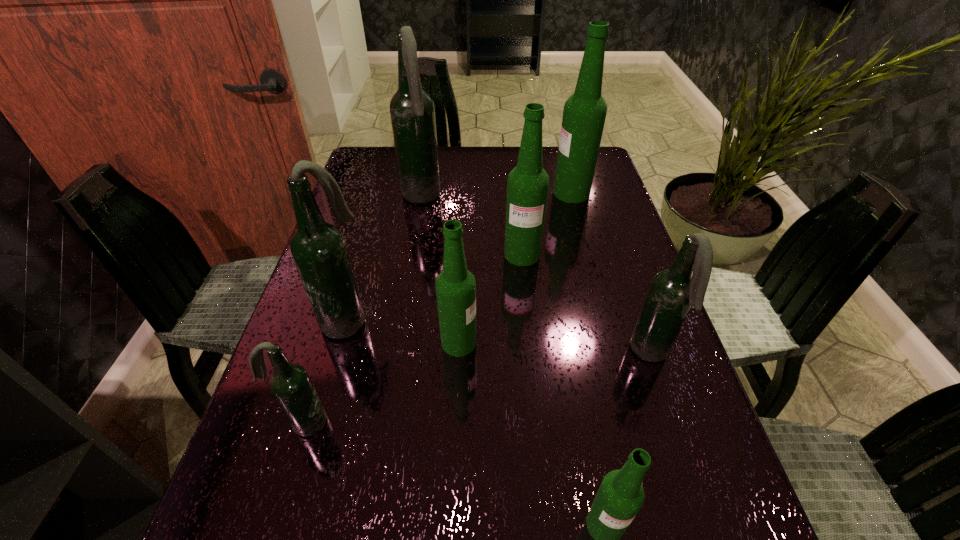
Locate an element on the screen. the second nearest object is located at coordinates (290, 383).

Identify the location of the smallest dark beer bottle. [290, 383].

You are a GUI agent. You are given a task and a screenshot of the screen. Output one action in this format:
    pyautogui.click(x=<x>, y=<y>)
    Task: Click on the vacant region located on the label of the farthest green beer bottle
    
    Given the screenshot: What is the action you would take?
    pyautogui.click(x=447, y=193)

Image resolution: width=960 pixels, height=540 pixels. Identify the location of free location located 0.350m on the label of the farthest green beer bottle. (434, 193).

What are the coordinates of `free location located 0.310m on the label of the farthest green beer bottle` in the screenshot? It's located at (447, 193).

This screenshot has height=540, width=960. What are the coordinates of `vacant space located 0.380m on the right of the third dark beer bottle from left to right` in the screenshot? It's located at (572, 198).

You are a GUI agent. You are given a task and a screenshot of the screen. Output one action in this format:
    pyautogui.click(x=<x>, y=<y>)
    Task: Click on the vacant space located on the label of the third smallest green beer bottle
    
    Given the screenshot: What is the action you would take?
    pyautogui.click(x=534, y=367)

The width and height of the screenshot is (960, 540). I want to click on free region located on the right of the second biggest dark beer bottle, so click(413, 320).

Where is `free location located 0.220m on the label of the second smallest green beer bottle`? free location located 0.220m on the label of the second smallest green beer bottle is located at coordinates (585, 342).

Identify the location of free space located on the back of the second smallest dark beer bottle. The image size is (960, 540). (624, 277).